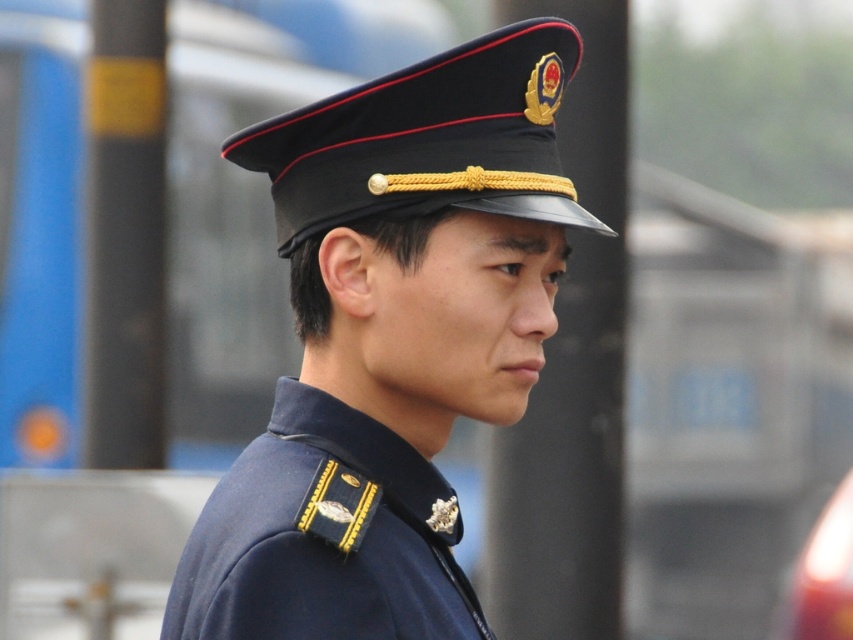
You are a photographer standing 10 feet away from the navy blue uniform at center. You want to take a clear photo of the uniform without including the camera in the frame. Is the distance sufficient?

The navy blue uniform at center and camera are 9.97 feet apart from each other. Since you are standing 10 feet away, the distance is sufficient to capture the uniform clearly while excluding the camera from the frame.

You are a tailor observing the navy blue uniform at center and the navy blue fabric at center in the image. Which item is positioned in front of the other?

The navy blue uniform at center is closer to the viewer than the navy blue fabric at center, so the uniform is in front of the fabric.